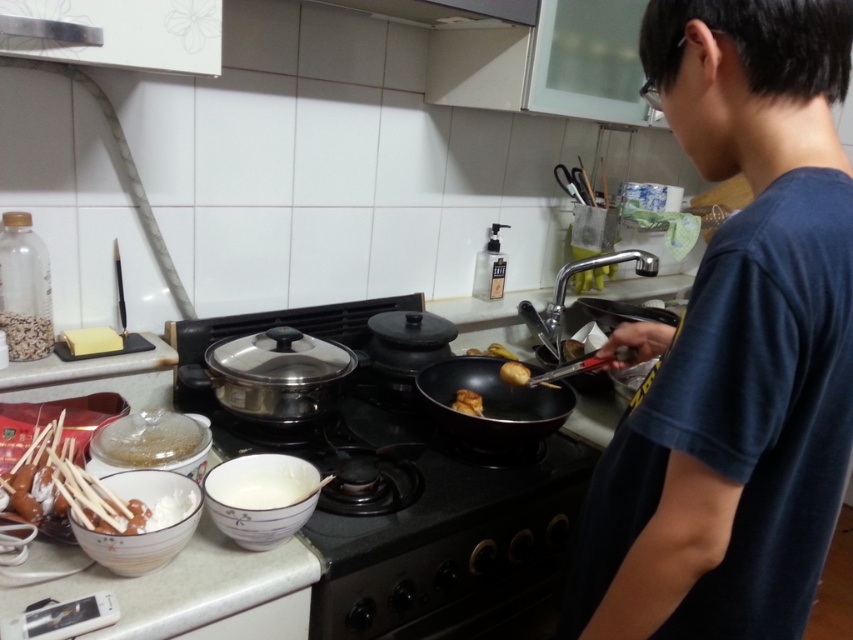
You are a chef trying to flip the golden crispy fried chicken at center using the black matte wok at center. Which direction should you move the wok to reach the chicken?

The black matte wok at center is to the right of the golden crispy fried chicken at center, so you should move the wok to the left to reach the chicken.